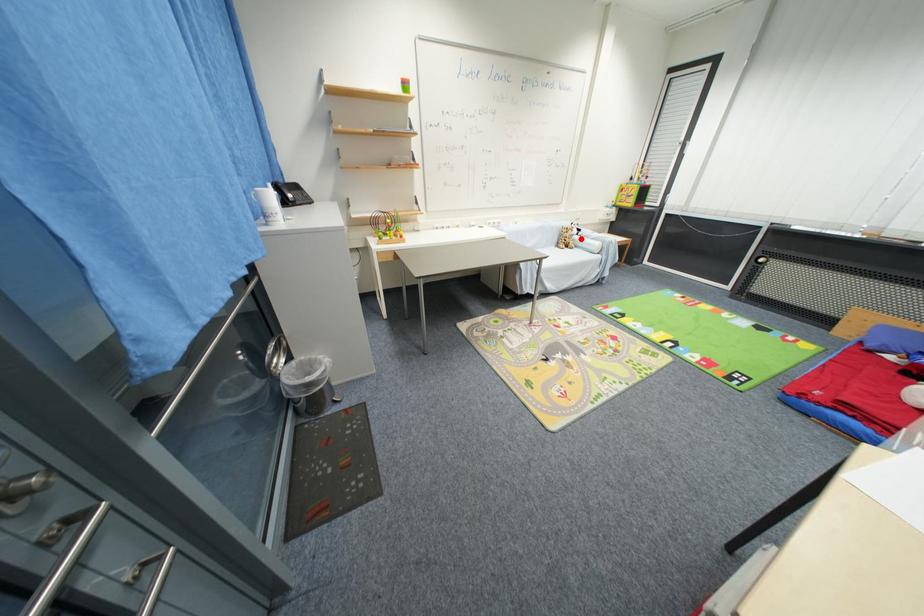
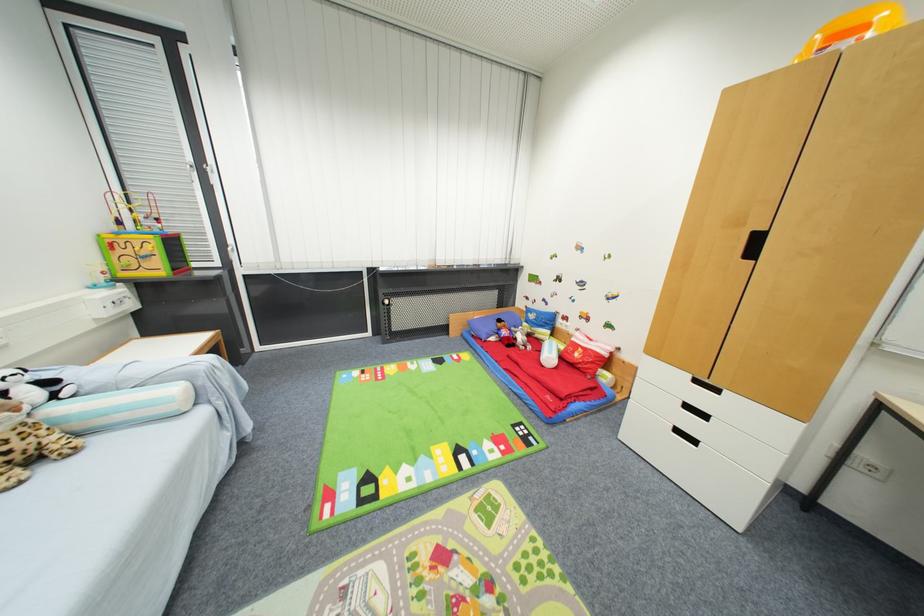
Where in the second image is the point corresponding to the highlighted location from the first image?

(64, 411)